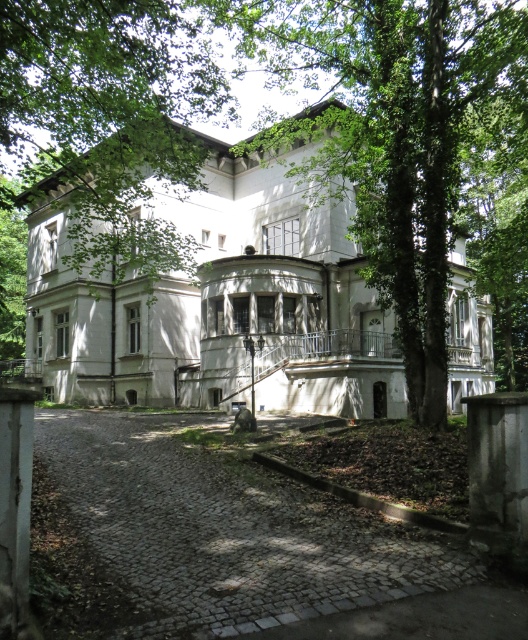
You are standing at the entrance of the building and want to walk towards the two points marked on the driveway. Which point, point (336, 620) or point (32, 628), is closer to you?

Point (336, 620) is closer to you because it is further to the viewer than point (32, 628).

You are a gardener planning to place a new decorative statue that is 2 meters wide in the area between the cobblestone driveway at lower center and the white stone pillar at left. Based on the scene, can the statue fit in that space?

The cobblestone driveway at lower center is larger in size than the white stone pillar at left. However, the exact dimensions of the space between them are not specified. Without knowing the width of the driveway or the distance to the pillar, it is impossible to determine if the 2 meter wide statue will fit.

You are standing at the entrance of the building and want to walk to the point marked by point (42, 268) and point (14, 605). Which point is closer to you?

Point (42, 268) is closer to you because it is further to the camera than point (14, 605).